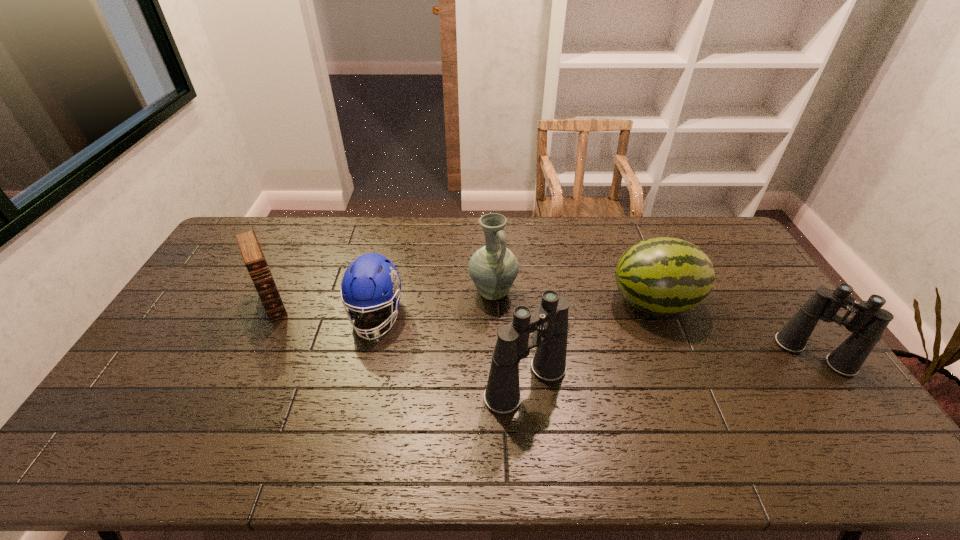
Given the evenly spaced binocularss in the image, where should an extra binoculars be added on the left to preserve the spacing? Please point to a vacant space. Please provide its 2D coordinates. Your answer should be formatted as a tuple, i.e. [(x, y)], where the tuple contains the x and y coordinates of a point satisfying the conditions above.

[(202, 416)]